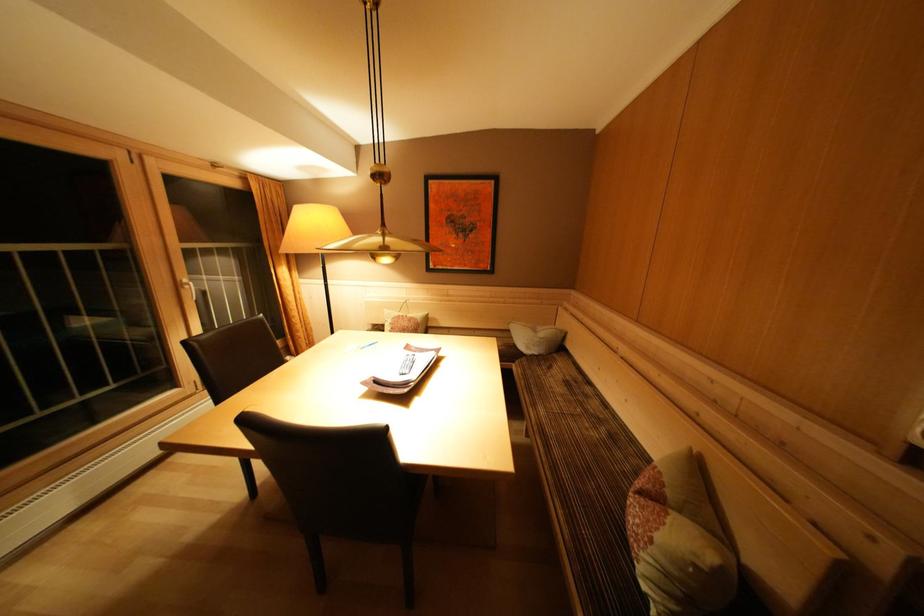
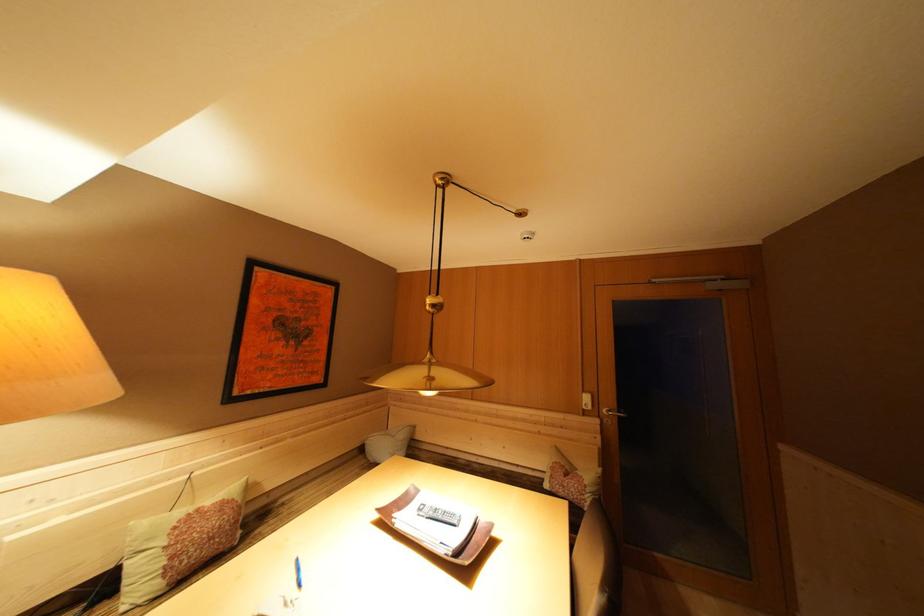
In the second image, find the point that corresponds to point (416, 350) in the first image.

(384, 515)